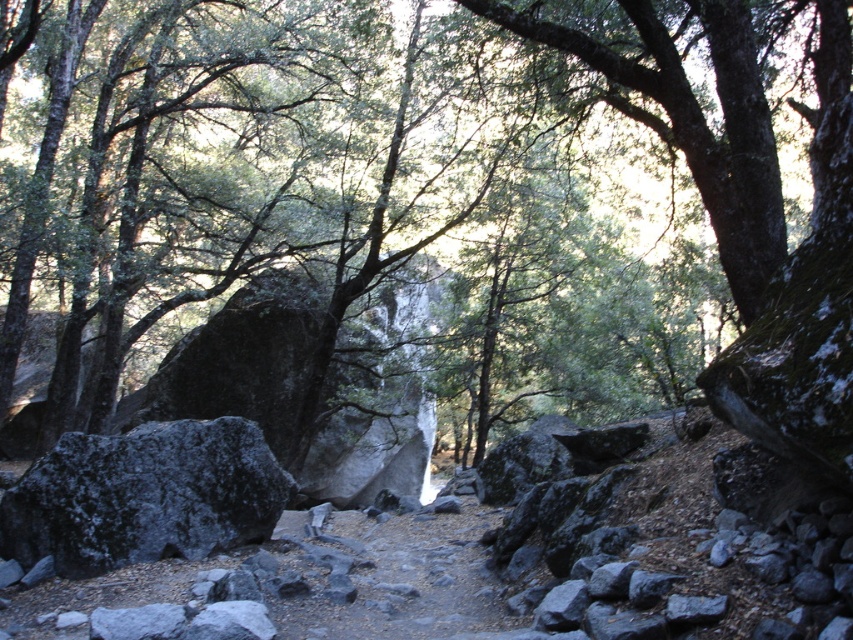
Question: Considering the relative positions of green mossy rock at center and gray rough rock at left in the image provided, where is green mossy rock at center located with respect to gray rough rock at left?

Choices:
 (A) below
 (B) above

Answer: (B)

Question: Which of the following is the closest to the observer?

Choices:
 (A) (325, 202)
 (B) (201, 452)

Answer: (B)

Question: Which object appears closest to the camera in this image?

Choices:
 (A) gray rough rock at left
 (B) green mossy rock at center

Answer: (B)

Question: Is green mossy rock at center above gray rough rock at left?

Choices:
 (A) yes
 (B) no

Answer: (A)

Question: Where is green mossy rock at center located in relation to gray rough rock at left in the image?

Choices:
 (A) right
 (B) left

Answer: (A)

Question: Which object appears closest to the camera in this image?

Choices:
 (A) green mossy rock at center
 (B) gray rough rock at left

Answer: (A)